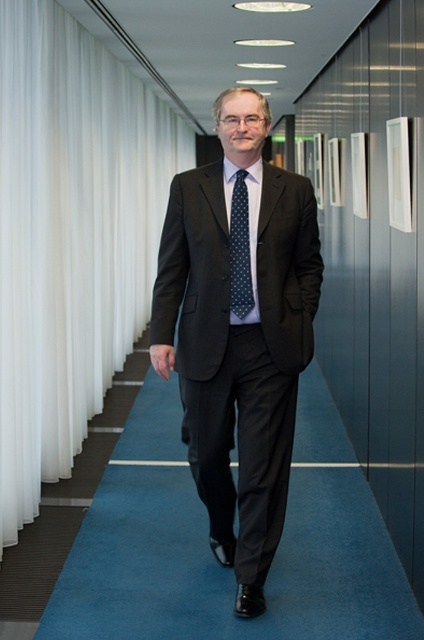
Question: Which of the following is the closest to the observer?

Choices:
 (A) dark green dotted tie at center
 (B) white sheer curtain at left

Answer: (A)

Question: Can you confirm if white sheer curtain at left is smaller than matte black suit at center?

Choices:
 (A) no
 (B) yes

Answer: (B)

Question: Does matte black suit at center have a larger size compared to dark green dotted tie at center?

Choices:
 (A) yes
 (B) no

Answer: (A)

Question: Can you confirm if matte black suit at center is smaller than dark green dotted tie at center?

Choices:
 (A) no
 (B) yes

Answer: (A)

Question: Among these points, which one is farthest from the camera?

Choices:
 (A) (137, 186)
 (B) (228, 320)
 (C) (237, 256)

Answer: (A)

Question: Which object is the farthest from the white sheer curtain at left?

Choices:
 (A) matte black suit at center
 (B) dark green dotted tie at center

Answer: (A)